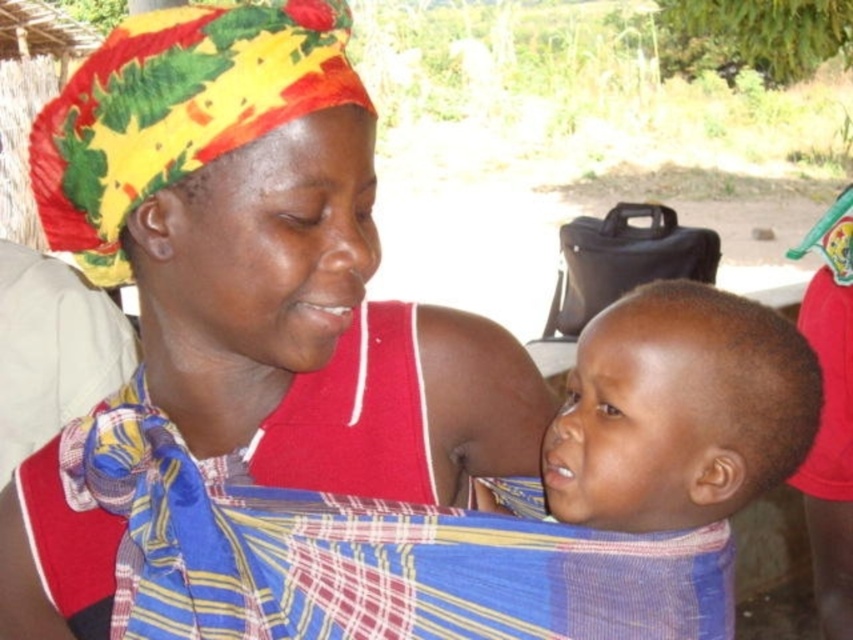
Question: Which object appears farthest from the camera in this image?

Choices:
 (A) smooth fabric baby at center
 (B) matte red tank top at center

Answer: (A)

Question: Can you confirm if matte red tank top at center is positioned below smooth fabric baby at center?

Choices:
 (A) no
 (B) yes

Answer: (A)

Question: Does matte red tank top at center appear on the right side of smooth fabric baby at center?

Choices:
 (A) yes
 (B) no

Answer: (B)

Question: Which point is closer to the camera taking this photo?

Choices:
 (A) (706, 621)
 (B) (223, 253)

Answer: (B)

Question: Is matte red tank top at center wider than smooth fabric baby at center?

Choices:
 (A) no
 (B) yes

Answer: (A)